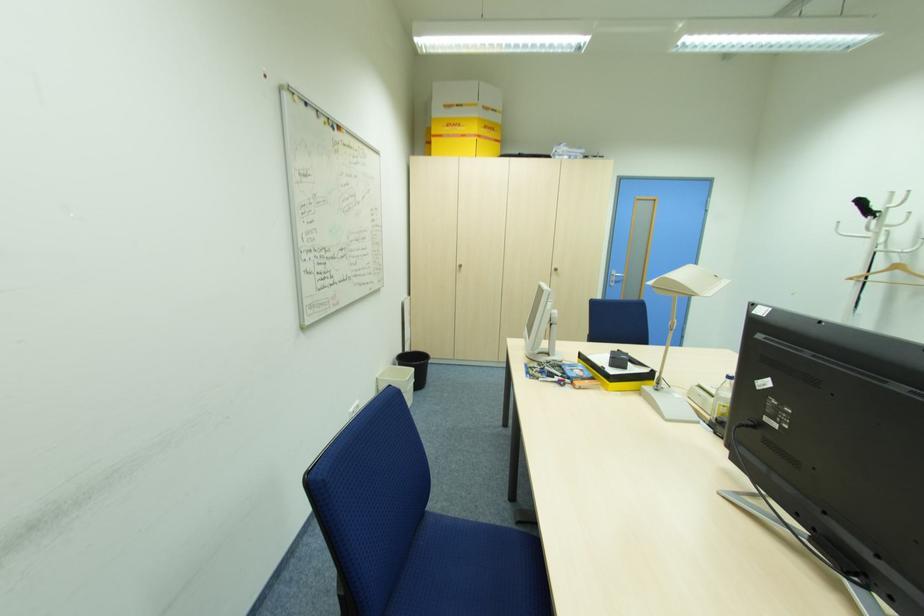
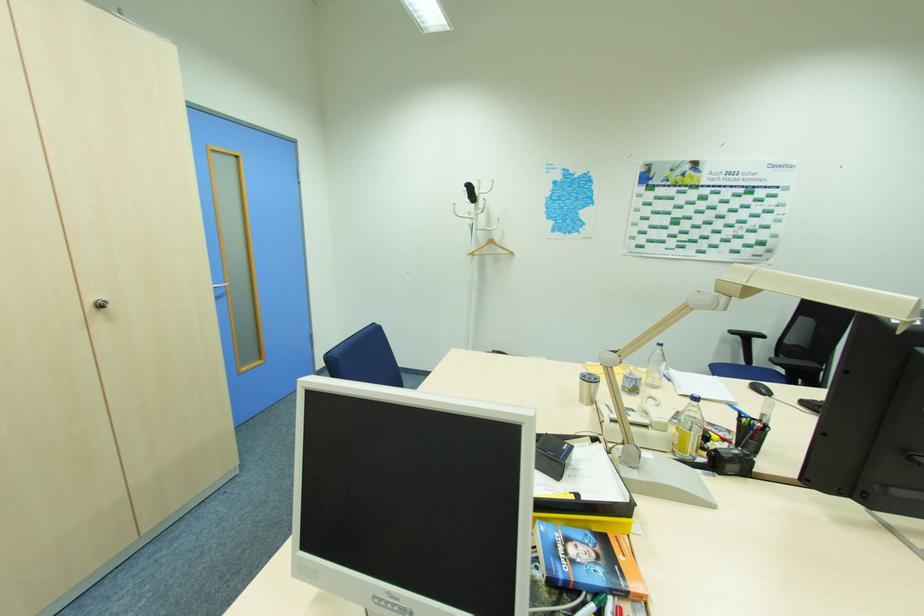
Where in the second image is the point corresponding to [854,278] from the first image?

(472, 254)